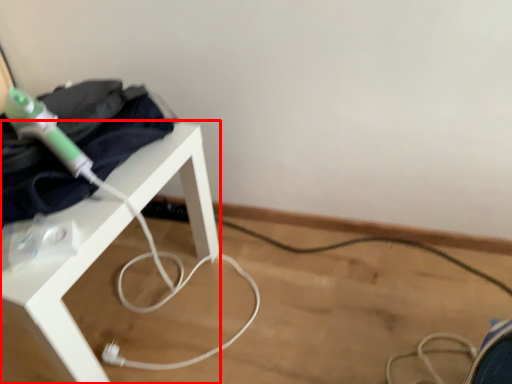
Question: From the image, what is the correct spatial relationship of table (annotated by the red box) in relation to clothing?

Choices:
 (A) right
 (B) left

Answer: (B)